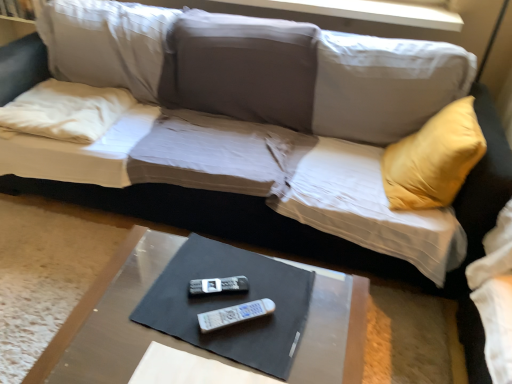
Where is `vacant space behind white plastic remote at center, the 1th remote in the front-to-back sequence`? The width and height of the screenshot is (512, 384). vacant space behind white plastic remote at center, the 1th remote in the front-to-back sequence is located at coordinates (242, 274).